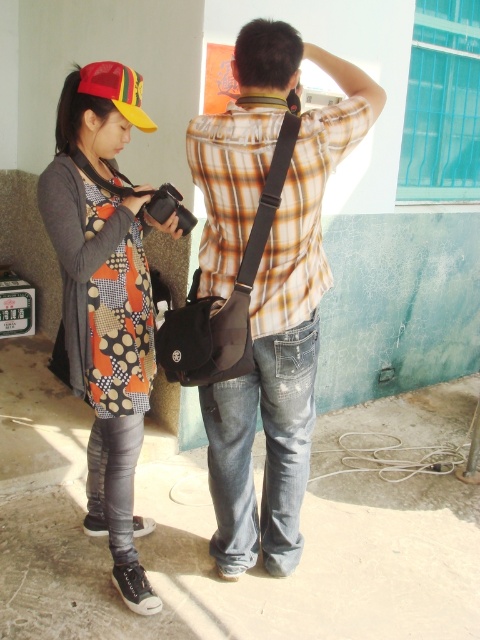
Looking at this image, who is positioned more to the right, plaid shirt at center or matte yellow baseball cap at upper left?

Positioned to the right is plaid shirt at center.

Does point (205, 179) come closer to viewer compared to point (117, 65)?

Yes, it is.

Find the location of `plaid shirt at center`. plaid shirt at center is located at coordinates (268, 284).

Does matte patchwork dress at center have a lesser height compared to matte yellow baseball cap at upper left?

No.

Who is lower down, matte patchwork dress at center or matte yellow baseball cap at upper left?

matte patchwork dress at center is below.

Who is more distant from viewer, (96, 349) or (110, 81)?

Positioned behind is point (96, 349).

In order to click on matte patchwork dress at center in this screenshot , I will do `click(106, 301)`.

Does plaid shirt at center come behind matte patchwork dress at center?

No.

Which is in front, point (264, 35) or point (132, 595)?

Point (264, 35)

This screenshot has width=480, height=640. I want to click on plaid shirt at center, so click(x=268, y=284).

This screenshot has height=640, width=480. Identify the location of plaid shirt at center. (268, 284).